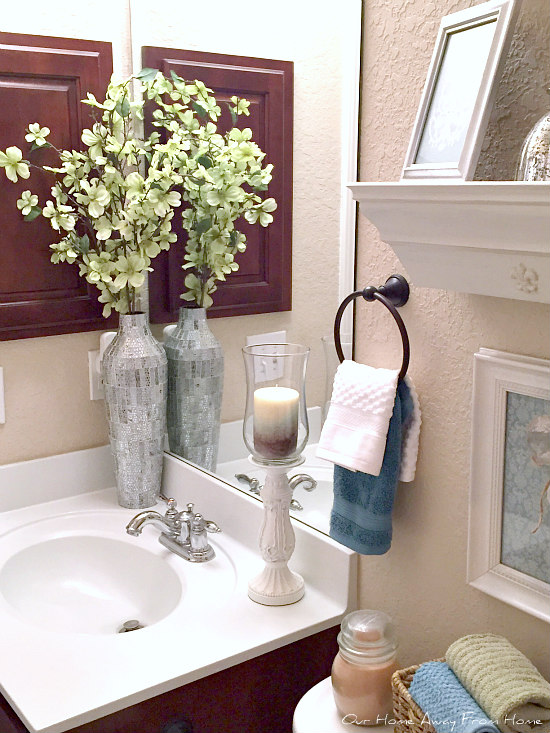
Find the location of a particular element. This screenshot has width=550, height=733. mirror is located at coordinates (294, 245).